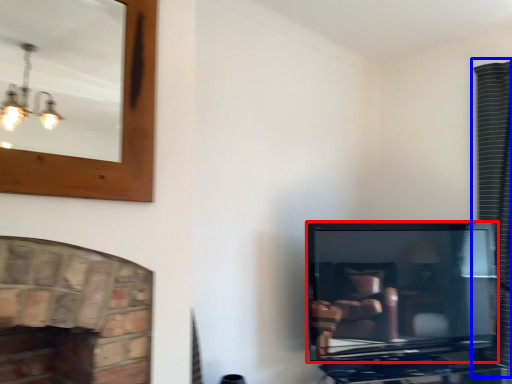
Question: Which object is closer to the camera taking this photo, television (highlighted by a red box) or curtain (highlighted by a blue box)?

Choices:
 (A) television
 (B) curtain

Answer: (A)